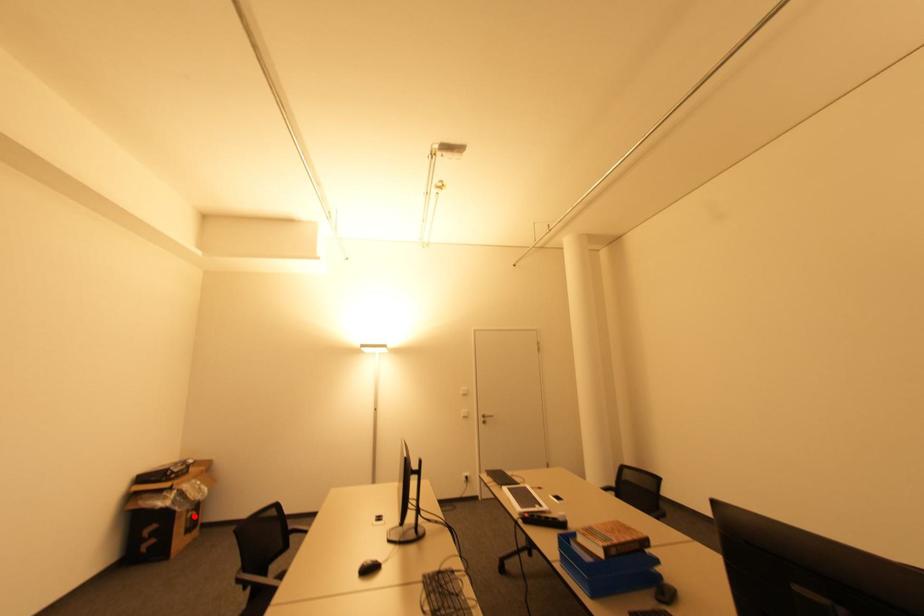
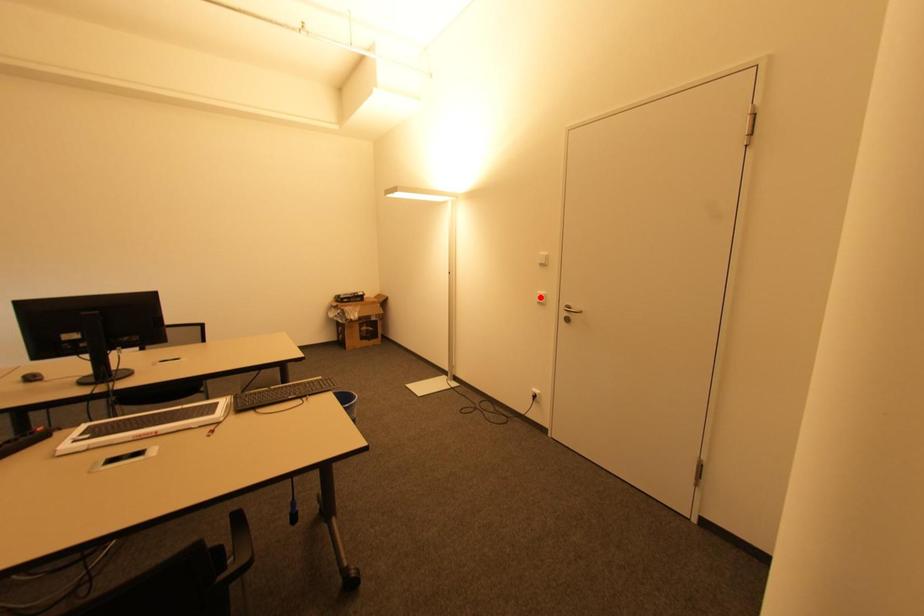
I am providing you with two images of the same scene from different viewpoints. A red point is marked on the first image and another point is marked on the second image. Do the highlighted points in image1 and image2 indicate the same real-world spot?

No